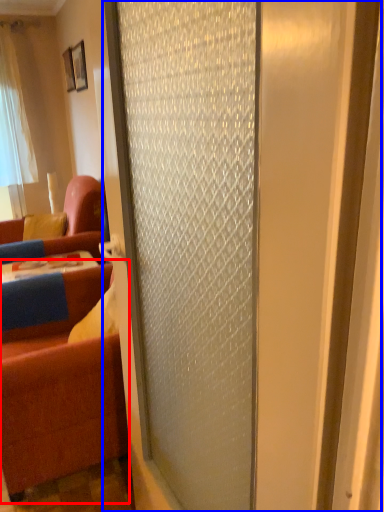
Question: Which of the following is the farthest to the observer, studio couch (highlighted by a red box) or door (highlighted by a blue box)?

Choices:
 (A) studio couch
 (B) door

Answer: (A)